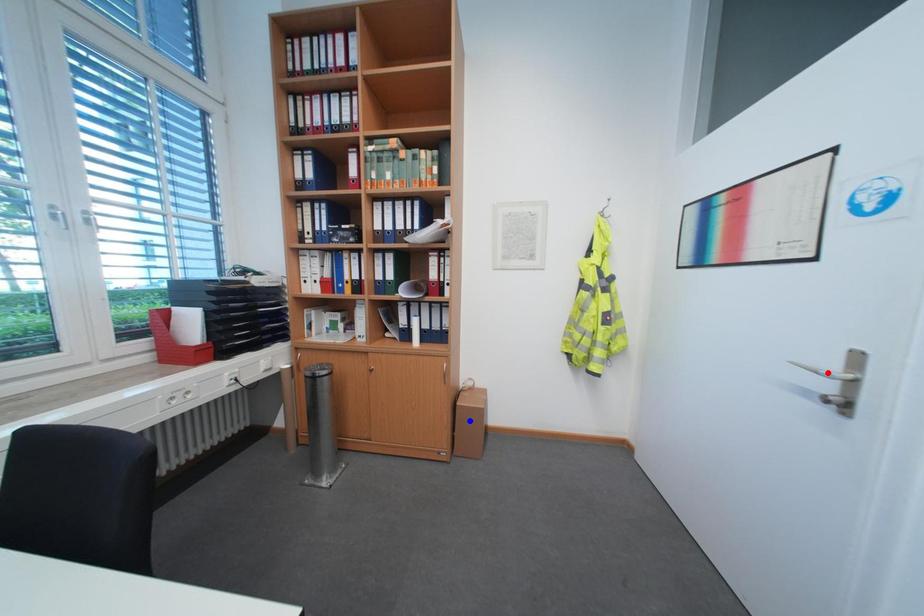
Question: In the image, two points are highlighted. Which point is nearer to the camera? Reply with the corresponding letter.

Choices:
 (A) blue point
 (B) red point

Answer: (B)